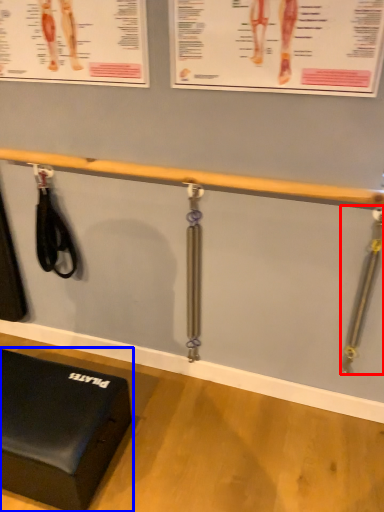
Question: Which of the following is the closest to the observer, tool (highlighted by a red box) or furniture (highlighted by a blue box)?

Choices:
 (A) tool
 (B) furniture

Answer: (B)